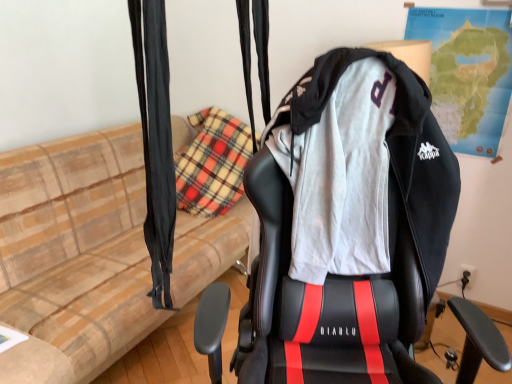
Question: Does paper map at upper right have a lesser width compared to black fabric curtain at left?

Choices:
 (A) yes
 (B) no

Answer: (A)

Question: Can you confirm if paper map at upper right is bigger than black fabric curtain at left?

Choices:
 (A) no
 (B) yes

Answer: (B)

Question: Is paper map at upper right oriented away from black fabric curtain at left?

Choices:
 (A) no
 (B) yes

Answer: (A)

Question: From the image's perspective, is paper map at upper right located above black fabric curtain at left?

Choices:
 (A) no
 (B) yes

Answer: (B)

Question: Can you confirm if paper map at upper right is shorter than black fabric curtain at left?

Choices:
 (A) yes
 (B) no

Answer: (B)

Question: Is the surface of paper map at upper right in direct contact with black fabric curtain at left?

Choices:
 (A) yes
 (B) no

Answer: (B)

Question: Is beige plaid couch at left further to the viewer compared to black leather gaming chair at center?

Choices:
 (A) yes
 (B) no

Answer: (A)

Question: Can you confirm if beige plaid couch at left is shorter than black leather gaming chair at center?

Choices:
 (A) no
 (B) yes

Answer: (B)

Question: Is beige plaid couch at left positioned far away from black leather gaming chair at center?

Choices:
 (A) yes
 (B) no

Answer: (A)

Question: Can you confirm if beige plaid couch at left is bigger than black leather gaming chair at center?

Choices:
 (A) no
 (B) yes

Answer: (B)

Question: Considering the relative sizes of beige plaid couch at left and black leather gaming chair at center in the image provided, is beige plaid couch at left smaller than black leather gaming chair at center?

Choices:
 (A) no
 (B) yes

Answer: (A)

Question: From the image's perspective, is beige plaid couch at left beneath black leather gaming chair at center?

Choices:
 (A) no
 (B) yes

Answer: (A)

Question: Does black leather gaming chair at center appear on the left side of beige plaid couch at left?

Choices:
 (A) yes
 (B) no

Answer: (B)